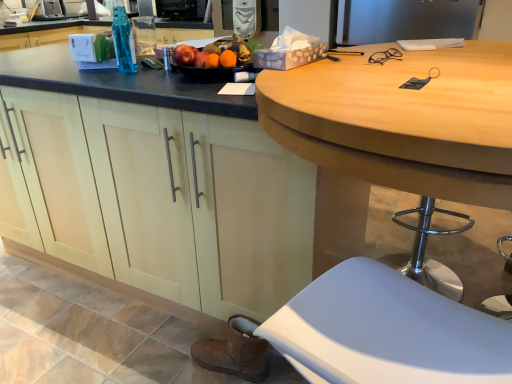
Where is `glossy wooden tray of fruits at center`? This screenshot has height=384, width=512. glossy wooden tray of fruits at center is located at coordinates (214, 54).

The image size is (512, 384). What do you see at coordinates (214, 54) in the screenshot?
I see `glossy wooden tray of fruits at center` at bounding box center [214, 54].

Measure the distance between matte wood cabinets at center and camera.

matte wood cabinets at center is 1.02 meters away from camera.

Locate an element on the screen. Image resolution: width=512 pixels, height=384 pixels. brushed metal sink at upper left is located at coordinates (55, 10).

This screenshot has height=384, width=512. What are the coordinates of `clear plastic glasses at upper right` in the screenshot? It's located at (385, 56).

You are a GUI agent. You are given a task and a screenshot of the screen. Output one action in this format:
    pyautogui.click(x=<x>, y=<y>)
    Task: Click on the translucent plastic bottle at upper center
    This screenshot has height=384, width=512.
    Given the screenshot: What is the action you would take?
    pyautogui.click(x=123, y=41)

At what (x,y) coordinates should I click in order to perform the action: click on glossy wooden tray of fruits at center. Please return your answer as a coordinate pair (x, y). Looking at the image, I should click on (214, 54).

How different are the orientations of brushed metal sink at upper left and translucent plastic bottle at upper center in degrees?

There is a 41.9-degree angle between the facing directions of brushed metal sink at upper left and translucent plastic bottle at upper center.

Is brushed metal sink at upper left thinner than translucent plastic bottle at upper center?

Incorrect, the width of brushed metal sink at upper left is not less than that of translucent plastic bottle at upper center.

Which of these two, brushed metal sink at upper left or translucent plastic bottle at upper center, is smaller?

translucent plastic bottle at upper center.

In the image, is brushed metal sink at upper left positioned in front of or behind translucent plastic bottle at upper center?

brushed metal sink at upper left is positioned farther from the viewer than translucent plastic bottle at upper center.

Does translucent plastic bottle at upper center have a larger size compared to brushed metal sink at upper left?

Incorrect, translucent plastic bottle at upper center is not larger than brushed metal sink at upper left.

Considering the relative sizes of translucent plastic bottle at upper center and brushed metal sink at upper left in the image provided, is translucent plastic bottle at upper center wider than brushed metal sink at upper left?

Incorrect, the width of translucent plastic bottle at upper center does not surpass that of brushed metal sink at upper left.

From the image's perspective, is translucent plastic bottle at upper center located above brushed metal sink at upper left?

Actually, translucent plastic bottle at upper center appears below brushed metal sink at upper left in the image.

Is point (112, 30) farther from viewer compared to point (39, 15)?

No.

Looking at this image, is white plastic stool at lower right oriented towards glossy wooden tray of fruits at center?

No, white plastic stool at lower right is not facing towards glossy wooden tray of fruits at center.

Does white plastic stool at lower right contain glossy wooden tray of fruits at center?

That's incorrect, glossy wooden tray of fruits at center is not inside white plastic stool at lower right.

Does clear plastic glasses at upper right have a lesser width compared to wooden desk at center?

Indeed, clear plastic glasses at upper right has a lesser width compared to wooden desk at center.

Is clear plastic glasses at upper right facing towards wooden desk at center?

Yes, clear plastic glasses at upper right is turned towards wooden desk at center.

Is clear plastic glasses at upper right positioned behind wooden desk at center?

Yes, it is.

Which is more to the right, clear plastic glasses at upper right or wooden desk at center?

wooden desk at center.

From a real-world perspective, does glossy wooden tray of fruits at center sit lower than wooden desk at center?

No.

Relative to wooden desk at center, is glossy wooden tray of fruits at center in front or behind?

In the image, glossy wooden tray of fruits at center appears behind wooden desk at center.

Considering the relative positions of glossy wooden tray of fruits at center and wooden desk at center in the image provided, is glossy wooden tray of fruits at center to the left or to the right of wooden desk at center?

glossy wooden tray of fruits at center is to the left of wooden desk at center.

From the image's perspective, is glossy wooden tray of fruits at center over wooden desk at center?

Yes, from the image's perspective, glossy wooden tray of fruits at center is above wooden desk at center.

Considering the relative positions of brushed metal sink at upper left and glossy wooden tray of fruits at center in the image provided, is brushed metal sink at upper left in front of glossy wooden tray of fruits at center?

No.

From the picture: Is brushed metal sink at upper left wider than glossy wooden tray of fruits at center?

No.

Is point (40, 9) in front of point (217, 58)?

No, (40, 9) is behind (217, 58).

Is point (131, 43) closer or farther from the camera than point (389, 57)?

Point (131, 43).

Is translucent plastic bottle at upper center looking in the opposite direction of clear plastic glasses at upper right?

No, clear plastic glasses at upper right is not at the back of translucent plastic bottle at upper center.

Can you confirm if translucent plastic bottle at upper center is shorter than clear plastic glasses at upper right?

No.

You are a GUI agent. You are given a task and a screenshot of the screen. Output one action in this format:
    pyautogui.click(x=<x>, y=<y>)
    Task: Click on the sink on the left of translucent plastic bottle at upper center
    The image size is (512, 384).
    Given the screenshot: What is the action you would take?
    tap(55, 10)

Locate an element on the screen. The image size is (512, 384). bottle above the brushed metal sink at upper left (from a real-world perspective) is located at coordinates (123, 41).

Which object lies further to the anchor point wooden desk at center, glossy wooden tray of fruits at center or matte wood cabinets at center?

The object further to wooden desk at center is glossy wooden tray of fruits at center.

Looking at the image, which one is located closer to translucent plastic bottle at upper center, brown suede boot at lower left or brushed metal sink at upper left?

brown suede boot at lower left.

Considering their positions, is brown suede boot at lower left positioned closer to white plastic stool at lower right than translucent plastic bottle at upper center?

brown suede boot at lower left lies closer to white plastic stool at lower right than the other object.

When comparing their distances from brushed metal sink at upper left, does brown suede boot at lower left or wooden desk at center seem further?

The object further to brushed metal sink at upper left is wooden desk at center.

From the image, which object appears to be nearer to matte wood cabinets at center, clear plastic glasses at upper right or brown suede boot at lower left?

brown suede boot at lower left.

Which object lies further to the anchor point glossy wooden tray of fruits at center, brown suede boot at lower left or wooden desk at center?

brown suede boot at lower left lies further to glossy wooden tray of fruits at center than the other object.

When comparing their distances from glossy wooden tray of fruits at center, does translucent plastic bottle at upper center or wooden desk at center seem further?

The object further to glossy wooden tray of fruits at center is wooden desk at center.

From the image, which object appears to be nearer to translucent plastic bottle at upper center, brushed metal sink at upper left or glossy wooden tray of fruits at center?

Based on the image, glossy wooden tray of fruits at center appears to be nearer to translucent plastic bottle at upper center.

Image resolution: width=512 pixels, height=384 pixels. I want to click on fruit between brown suede boot at lower left and brushed metal sink at upper left in the front-back direction, so click(x=214, y=54).

Where is `glasses between wooden desk at center and brushed metal sink at upper left in the front-back direction`? The height and width of the screenshot is (384, 512). glasses between wooden desk at center and brushed metal sink at upper left in the front-back direction is located at coordinates (385, 56).

Where is `cabinetry between translucent plastic bottle at upper center and clear plastic glasses at upper right`? The height and width of the screenshot is (384, 512). cabinetry between translucent plastic bottle at upper center and clear plastic glasses at upper right is located at coordinates (162, 200).

Identify the location of bottle between white plastic stool at lower right and brushed metal sink at upper left from front to back. The height and width of the screenshot is (384, 512). (123, 41).